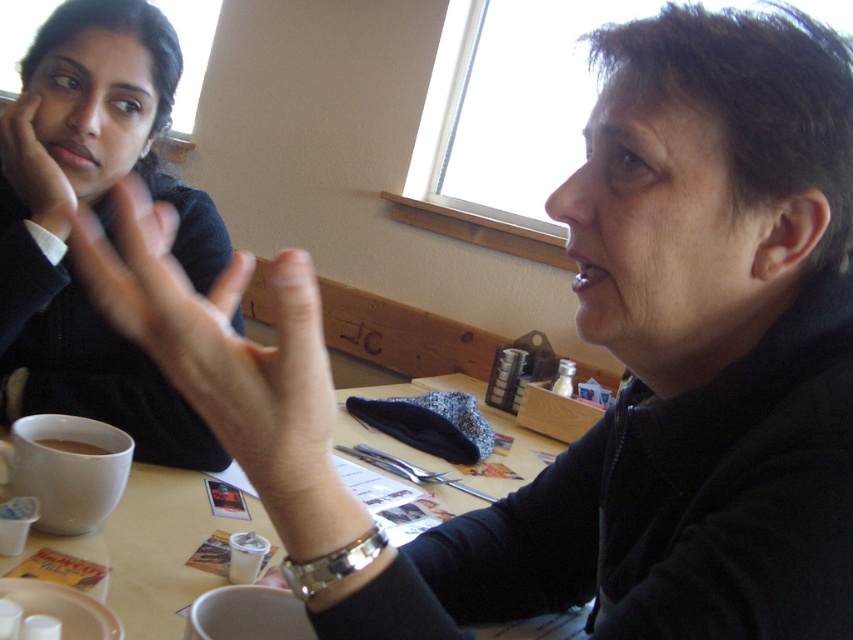
You are a fashion designer observing the matte black sweater at upper left and the skinny white hand at center in the image. Which object takes up more horizontal space?

The skinny white hand at center takes up more horizontal space than the matte black sweater at upper left.

You are a waiter and need to deliver a drink to the person on the right. The white matte mug at lower left contains coffee, and the matte white cup at lower left has tea. Which object should you move to reach the drink the customer ordered?

The white matte mug at lower left is in front of the matte white cup at lower left. To reach the tea in the matte white cup at lower left, you would need to move the white matte mug at lower left out of the way first.

You are a delivery person who needs to place a package on the table. The package is 10 cm tall. The table is currently holding several items. Is there enough vertical space between the matte plastic table at center and the matte black hand at upper left to place the package without it touching the hand?

The matte plastic table at center is located below the matte black hand at upper left, so there is enough vertical space to place the package without it touching the hand.